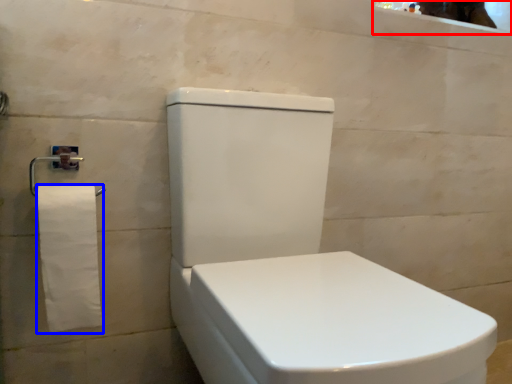
Question: Among these objects, which one is farthest to the camera, mirror (highlighted by a red box) or toilet paper (highlighted by a blue box)?

Choices:
 (A) mirror
 (B) toilet paper

Answer: (A)